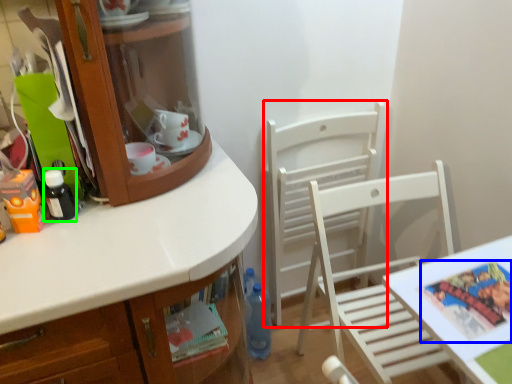
Question: Which object is the closest to the chair (highlighted by a red box)? Choose among these: comic book (highlighted by a blue box) or bottle (highlighted by a green box).

Choices:
 (A) comic book
 (B) bottle

Answer: (A)